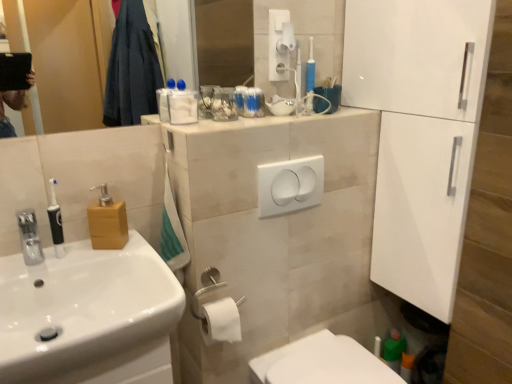
What is the approximate height of beige tile counter at upper center?

beige tile counter at upper center is 0.51 inches in height.

What do you see at coordinates (276, 121) in the screenshot? I see `beige tile counter at upper center` at bounding box center [276, 121].

This screenshot has width=512, height=384. What do you see at coordinates (288, 35) in the screenshot?
I see `white matte toilet paper at upper center, positioned as the 2th toilet paper in bottom-to-top order` at bounding box center [288, 35].

The width and height of the screenshot is (512, 384). What do you see at coordinates (221, 321) in the screenshot?
I see `white matte toilet paper at lower center, positioned as the 1th toilet paper in left-to-right order` at bounding box center [221, 321].

I want to click on white plastic light switch at center, so click(x=290, y=185).

What do you see at coordinates (290, 185) in the screenshot? The width and height of the screenshot is (512, 384). I see `white plastic light switch at center` at bounding box center [290, 185].

Locate an element on the screen. The width and height of the screenshot is (512, 384). white glossy cabinet at right is located at coordinates (419, 133).

At what (x,y) coordinates should I click in order to perform the action: click on white glossy toilet at lower center. Please return your answer as a coordinate pair (x, y). This screenshot has height=384, width=512. Looking at the image, I should click on (321, 363).

Locate an element on the screen. The height and width of the screenshot is (384, 512). beige tile counter at upper center is located at coordinates (276, 121).

How far apart are clear glass mirror at upper left and white plastic hand dryer at upper center?

clear glass mirror at upper left is 2.17 meters from white plastic hand dryer at upper center.

Is clear glass mirror at upper left oriented towards white plastic hand dryer at upper center?

No, clear glass mirror at upper left is not oriented towards white plastic hand dryer at upper center.

Is clear glass mirror at upper left touching white plastic hand dryer at upper center?

No, clear glass mirror at upper left is not next to white plastic hand dryer at upper center.

Find the location of `hand dryer behind the clear glass mirror at upper left`. hand dryer behind the clear glass mirror at upper left is located at coordinates (280, 44).

At what (x,y) coordinates should I click in order to perform the action: click on towel bar that appears below the clear glass mirror at upper left (from a real-world perspective). Please return your answer as a coordinate pair (x, y). This screenshot has width=512, height=384. Looking at the image, I should click on (205, 289).

From the image's perspective, is satin silver toilet paper holder at lower center below clear glass mirror at upper left?

Yes.

Is satin silver toilet paper holder at lower center oriented towards clear glass mirror at upper left?

No, satin silver toilet paper holder at lower center is not aimed at clear glass mirror at upper left.

Is wooden soap dispenser at left to the right of beige tile counter at upper center from the viewer's perspective?

No.

Can you confirm if wooden soap dispenser at left is thinner than beige tile counter at upper center?

Yes, wooden soap dispenser at left is thinner than beige tile counter at upper center.

Is wooden soap dispenser at left closer to camera compared to beige tile counter at upper center?

That is False.

In order to click on soap dispenser located on the left of beige tile counter at upper center in this screenshot , I will do `click(106, 222)`.

At what (x,y) coordinates should I click in order to perform the action: click on toilet paper that is above the white glossy cabinet at right (from the image's perspective). Please return your answer as a coordinate pair (x, y). Looking at the image, I should click on (288, 35).

Which of these two, white glossy cabinet at right or white matte toilet paper at upper center, acting as the first toilet paper starting from the top, is smaller?

Smaller between the two is white matte toilet paper at upper center, acting as the first toilet paper starting from the top.

Considering the relative positions of white glossy cabinet at right and white matte toilet paper at upper center, which appears as the first toilet paper when viewed from the back, in the image provided, is white glossy cabinet at right to the right of white matte toilet paper at upper center, which appears as the first toilet paper when viewed from the back, from the viewer's perspective?

Yes, white glossy cabinet at right is to the right of white matte toilet paper at upper center, which appears as the first toilet paper when viewed from the back.

From a real-world perspective, is white glossy cabinet at right below white matte toilet paper at upper center, the 1th toilet paper in the right-to-left sequence?

Yes, from a real-world perspective, white glossy cabinet at right is below white matte toilet paper at upper center, the 1th toilet paper in the right-to-left sequence.

Is clear glass mirror at upper left taller than wooden soap dispenser at left?

Correct, clear glass mirror at upper left is much taller as wooden soap dispenser at left.

Is clear glass mirror at upper left located outside wooden soap dispenser at left?

clear glass mirror at upper left lies outside wooden soap dispenser at left's area.

Considering the relative sizes of clear glass mirror at upper left and wooden soap dispenser at left in the image provided, is clear glass mirror at upper left smaller than wooden soap dispenser at left?

No.

From a real-world perspective, is clear glass mirror at upper left on wooden soap dispenser at left?

Yes, from a real-world perspective, clear glass mirror at upper left is on top of wooden soap dispenser at left.

How different are the orientations of black rubberized toothbrush at left, which is counted as the 2th toiletry, starting from the right, and white plastic light switch at center in degrees?

They differ by 2.1 degrees in their facing directions.

From the image's perspective, is black rubberized toothbrush at left, which appears as the second toiletry when viewed from the back, located beneath white plastic light switch at center?

Yes.

Is black rubberized toothbrush at left, the first toiletry viewed from the front, in contact with white plastic light switch at center?

They are not placed beside each other.

You are a GUI agent. You are given a task and a screenshot of the screen. Output one action in this format:
    pyautogui.click(x=<x>, y=<y>)
    Task: Click on the toiletry located underneath the white plastic light switch at center (from a real-world perspective)
    This screenshot has height=384, width=512.
    Given the screenshot: What is the action you would take?
    pyautogui.click(x=56, y=221)

Between point (293, 49) and point (293, 358), which one is positioned behind?

The point (293, 49) is more distant.

From the image's perspective, is white matte toilet paper at upper center, acting as the first toilet paper starting from the top, below white glossy toilet at lower center?

No.

Which is in front, white matte toilet paper at upper center, which appears as the first toilet paper when viewed from the back, or white glossy toilet at lower center?

white glossy toilet at lower center.

From a real-world perspective, between white matte toilet paper at upper center, the 1th toilet paper in the right-to-left sequence, and white glossy toilet at lower center, who is vertically lower?

white glossy toilet at lower center.

Identify the location of mirror below the white plastic hand dryer at upper center (from a real-world perspective). (246, 41).

Find the location of `towel bar below the clear glass mirror at upper left (from the image's perspective)`. towel bar below the clear glass mirror at upper left (from the image's perspective) is located at coordinates (205, 289).

Considering their positions, is white matte toilet paper at upper center, positioned as the 2th toilet paper in bottom-to-top order, positioned further to white plastic light switch at center than white glossy toilet at lower center?

Based on the image, white glossy toilet at lower center appears to be further to white plastic light switch at center.

Looking at this image, considering their positions, is beige tile counter at upper center positioned further to satin silver toilet paper holder at lower center than wooden soap dispenser at left?

beige tile counter at upper center.

Considering their positions, is satin silver toilet paper holder at lower center positioned further to white glossy cabinet at right than white glossy toilet at lower center?

The object further to white glossy cabinet at right is satin silver toilet paper holder at lower center.

Looking at the image, which one is located further to clear glass mirror at upper left, satin silver toilet paper holder at lower center or white plastic hand dryer at upper center?

satin silver toilet paper holder at lower center is further to clear glass mirror at upper left.

Which object lies nearer to the anchor point beige tile counter at upper center, clear glass mirror at upper left or white matte toilet paper at upper center, the 2th toilet paper positioned from the front?

white matte toilet paper at upper center, the 2th toilet paper positioned from the front, is closer to beige tile counter at upper center.

Considering their positions, is white plastic hand dryer at upper center positioned further to white glossy cabinet at right than black rubberized toothbrush at left, which appears as the second toiletry when viewed from the back?

Based on the image, black rubberized toothbrush at left, which appears as the second toiletry when viewed from the back, appears to be further to white glossy cabinet at right.

Which object lies further to the anchor point white glossy sink at left, clear glass mirror at upper left or white matte toilet paper at lower center, positioned as the 1th toilet paper in left-to-right order?

clear glass mirror at upper left lies further to white glossy sink at left than the other object.

Based on their spatial positions, is white matte toilet paper at upper center, the 2th toilet paper positioned from the front, or satin silver toilet paper holder at lower center further from translucent plastic toothbrushes at upper center, arranged as the second toiletry when viewed from the left?

satin silver toilet paper holder at lower center.

What are the coordinates of `sink between black rubberized toothbrush at left, the first toiletry viewed from the front, and white glossy cabinet at right from left to right` in the screenshot? It's located at (89, 316).

Where is `toiletry between clear glass mirror at upper left and wooden soap dispenser at left from top to bottom`? toiletry between clear glass mirror at upper left and wooden soap dispenser at left from top to bottom is located at coordinates (249, 101).

I want to click on toiletry between translucent plastic toothbrushes at upper center, arranged as the second toiletry when ordered from the bottom, and white matte toilet paper at lower center, the first toilet paper positioned from the front, from top to bottom, so click(x=56, y=221).

The width and height of the screenshot is (512, 384). What are the coordinates of `toiletry between beige tile counter at upper center and white glossy toilet at lower center in the vertical direction` in the screenshot? It's located at (56, 221).